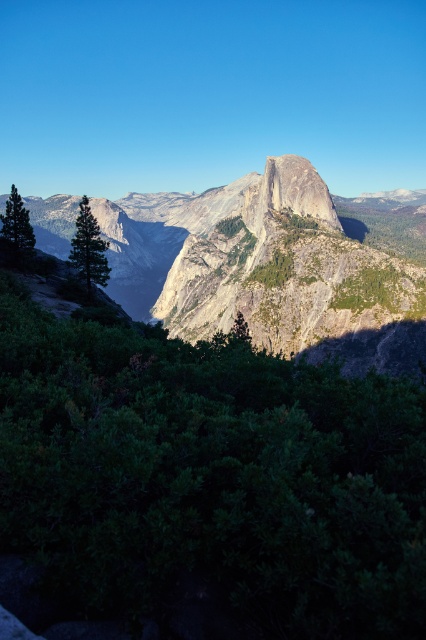
Which is more to the left, granite peak at center or green leafy tree at center?

Positioned to the left is green leafy tree at center.

Who is higher up, granite peak at center or green leafy tree at center?

granite peak at center is above.

At what (x,y) coordinates should I click in order to perform the action: click on granite peak at center. Please return your answer as a coordinate pair (x, y). The image size is (426, 640). Looking at the image, I should click on (296, 188).

Looking at this image, who is shorter, granite cliff at center or green leafy tree at center?

green leafy tree at center is shorter.

Can you confirm if granite cliff at center is positioned to the right of green leafy tree at center?

Yes, granite cliff at center is to the right of green leafy tree at center.

Locate an element on the screen. The width and height of the screenshot is (426, 640). granite cliff at center is located at coordinates (275, 266).

Based on the photo, which is above, granite cliff at center or green matte tree at left?

granite cliff at center is higher up.

Consider the image. Who is positioned more to the right, granite cliff at center or green matte tree at left?

granite cliff at center is more to the right.

Locate an element on the screen. The image size is (426, 640). granite cliff at center is located at coordinates (275, 266).

Find the location of a particular element. The width and height of the screenshot is (426, 640). granite cliff at center is located at coordinates (275, 266).